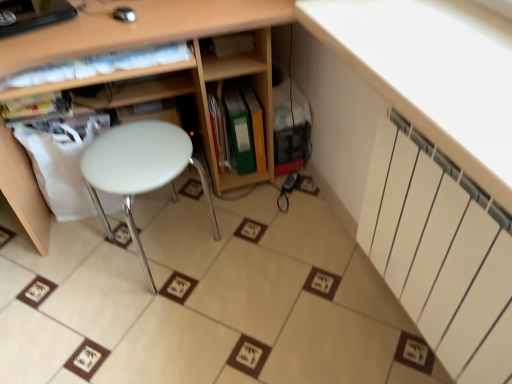
Question: Is white plastic stool at center in contact with green matte folder at center, positioned as the first book in right-to-left order?

Choices:
 (A) yes
 (B) no

Answer: (B)

Question: From a real-world perspective, is white plastic stool at center on top of green matte folder at center, positioned as the first book in right-to-left order?

Choices:
 (A) yes
 (B) no

Answer: (A)

Question: From the image's perspective, is white plastic stool at center over green matte folder at center, the third book from the left?

Choices:
 (A) no
 (B) yes

Answer: (A)

Question: From the image's perspective, would you say white plastic stool at center is shown under green matte folder at center, positioned as the first book in right-to-left order?

Choices:
 (A) yes
 (B) no

Answer: (A)

Question: Does white plastic stool at center appear on the left side of green matte folder at center, positioned as the first book in right-to-left order?

Choices:
 (A) no
 (B) yes

Answer: (B)

Question: Can you confirm if white plastic stool at center is bigger than green matte folder at center, the third book from the left?

Choices:
 (A) yes
 (B) no

Answer: (A)

Question: From a real-world perspective, is green matte folder at center, the third book from the left, located higher than white plastic stool at center?

Choices:
 (A) yes
 (B) no

Answer: (B)

Question: Would you say green matte folder at center, the third book from the left, is outside white plastic stool at center?

Choices:
 (A) yes
 (B) no

Answer: (A)

Question: Is green matte folder at center, positioned as the first book in right-to-left order, far from white plastic stool at center?

Choices:
 (A) no
 (B) yes

Answer: (A)

Question: Does green matte folder at center, positioned as the first book in right-to-left order, have a greater height compared to white plastic stool at center?

Choices:
 (A) yes
 (B) no

Answer: (B)

Question: From the image's perspective, is green matte folder at center, the third book from the left, on white plastic stool at center?

Choices:
 (A) yes
 (B) no

Answer: (A)

Question: Is green matte folder at center, the third book from the left, further to the viewer compared to white plastic stool at center?

Choices:
 (A) no
 (B) yes

Answer: (B)

Question: Considering the relative positions of green matte folder at center, the third book from the left, and green matte folder at center, positioned as the second book in left-to-right order, in the image provided, is green matte folder at center, the third book from the left, to the left of green matte folder at center, positioned as the second book in left-to-right order, from the viewer's perspective?

Choices:
 (A) yes
 (B) no

Answer: (B)